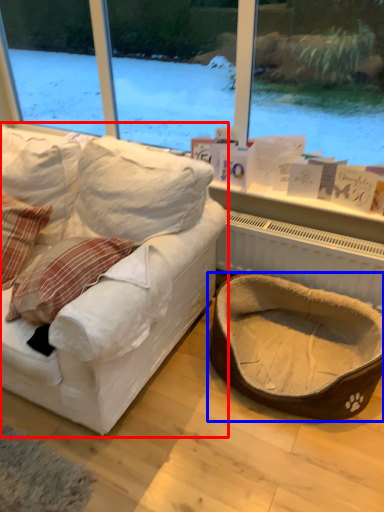
Question: Which object appears closest to the camera in this image, studio couch (highlighted by a red box) or dog bed (highlighted by a blue box)?

Choices:
 (A) studio couch
 (B) dog bed

Answer: (A)